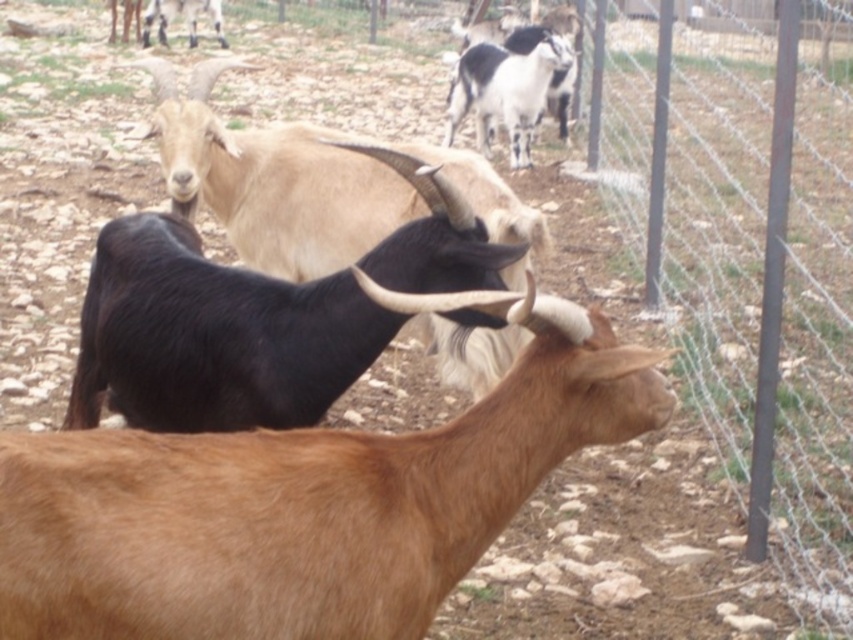
Question: Which point appears farthest from the camera in this image?

Choices:
 (A) (1, 547)
 (B) (519, 96)
 (C) (146, 13)

Answer: (C)

Question: Does black matte/goat at center lie in front of light brown woolen goat at upper center?

Choices:
 (A) yes
 (B) no

Answer: (A)

Question: Which point is closer to the camera?

Choices:
 (A) (335, 541)
 (B) (170, 16)
 (C) (285, 177)
 (D) (556, 44)

Answer: (A)

Question: Observing the image, what is the correct spatial positioning of black woolen goat at center in reference to white and black fur at upper center?

Choices:
 (A) right
 (B) left

Answer: (B)

Question: Among these points, which one is nearest to the camera?

Choices:
 (A) (213, 12)
 (B) (532, 60)
 (C) (373, 634)

Answer: (C)

Question: Is black woolen goat at center positioned before light brown woolen goat at upper center?

Choices:
 (A) no
 (B) yes

Answer: (B)